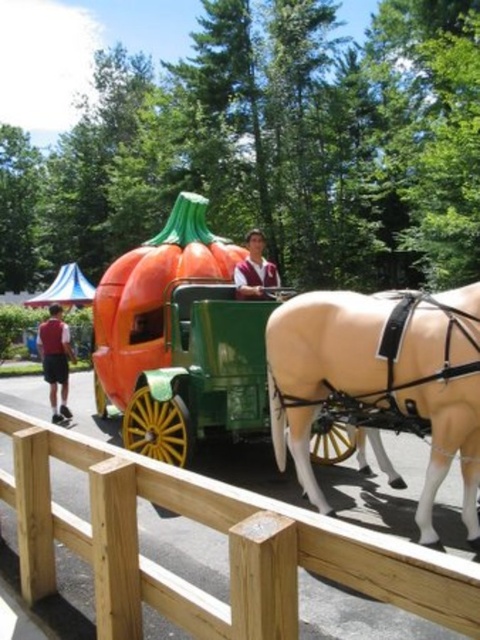
From the picture: Who is positioned more to the left, tan matte horse at center or matte brown vest at center?

matte brown vest at center is more to the left.

Can you confirm if tan matte horse at center is taller than matte brown vest at center?

Yes, tan matte horse at center is taller than matte brown vest at center.

Is point (410, 413) in front of point (241, 289)?

Yes, it is in front of point (241, 289).

Identify the location of tan matte horse at center. (382, 378).

Does point (51, 368) lie in front of point (263, 289)?

No, (51, 368) is further to viewer.

The image size is (480, 640). Identify the location of matte red shorts at lower left. pos(56,358).

Is the position of tan matte horse at center more distant than that of matte red shorts at lower left?

No, it is in front of matte red shorts at lower left.

Is point (320, 307) positioned behind point (52, 305)?

No, it is not.

Measure the distance between tan matte horse at center and camera.

tan matte horse at center is 3.46 meters away from camera.

Identify the location of tan matte horse at center. (382, 378).